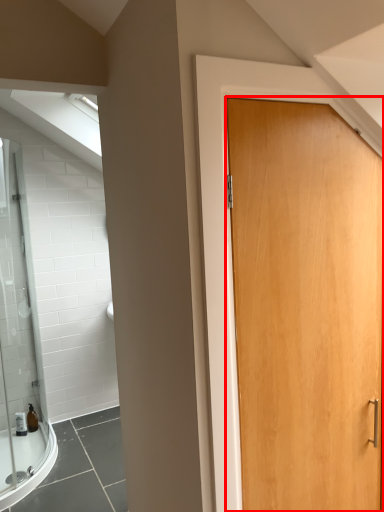
Question: From the image's perspective, where is door (annotated by the red box) located relative to toiletry?

Choices:
 (A) above
 (B) below

Answer: (A)